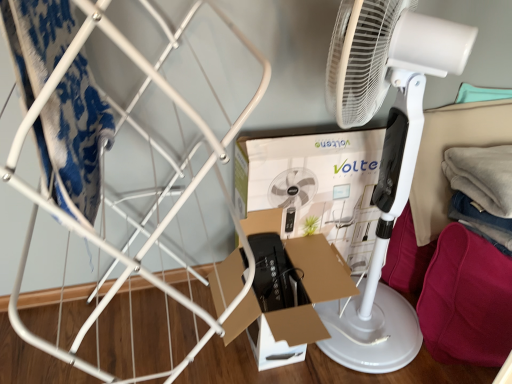
Question: Considering the relative sizes of cardboard box at center and white cardboard box at center in the image provided, is cardboard box at center wider than white cardboard box at center?

Choices:
 (A) no
 (B) yes

Answer: (B)

Question: Is cardboard box at center positioned with its back to white cardboard box at center?

Choices:
 (A) yes
 (B) no

Answer: (A)

Question: Considering the relative sizes of cardboard box at center and white cardboard box at center in the image provided, is cardboard box at center taller than white cardboard box at center?

Choices:
 (A) no
 (B) yes

Answer: (A)

Question: Does cardboard box at center come in front of white cardboard box at center?

Choices:
 (A) no
 (B) yes

Answer: (B)

Question: From the image's perspective, is cardboard box at center under white cardboard box at center?

Choices:
 (A) yes
 (B) no

Answer: (A)

Question: From the image's perspective, is white cardboard box at center above or below white plastic mechanical fan at center?

Choices:
 (A) below
 (B) above

Answer: (A)

Question: From a real-world perspective, is white cardboard box at center physically located above or below white plastic mechanical fan at center?

Choices:
 (A) below
 (B) above

Answer: (A)

Question: Do you think white cardboard box at center is within white plastic mechanical fan at center, or outside of it?

Choices:
 (A) outside
 (B) inside

Answer: (A)

Question: In terms of height, does white cardboard box at center look taller or shorter compared to white plastic mechanical fan at center?

Choices:
 (A) tall
 (B) short

Answer: (B)

Question: From a real-world perspective, is white plastic mechanical fan at center positioned above or below cardboard box at center?

Choices:
 (A) above
 (B) below

Answer: (A)

Question: Do you think white plastic mechanical fan at center is within cardboard box at center, or outside of it?

Choices:
 (A) outside
 (B) inside

Answer: (A)

Question: Considering the positions of white plastic mechanical fan at center and cardboard box at center in the image, is white plastic mechanical fan at center bigger or smaller than cardboard box at center?

Choices:
 (A) small
 (B) big

Answer: (B)

Question: Is point (384, 168) positioned closer to the camera than point (313, 301)?

Choices:
 (A) farther
 (B) closer

Answer: (B)

Question: Visually, is burgundy fabric cushion at lower right positioned to the left or to the right of white plastic mechanical fan at center?

Choices:
 (A) left
 (B) right

Answer: (B)

Question: In terms of height, does burgundy fabric cushion at lower right look taller or shorter compared to white plastic mechanical fan at center?

Choices:
 (A) tall
 (B) short

Answer: (B)